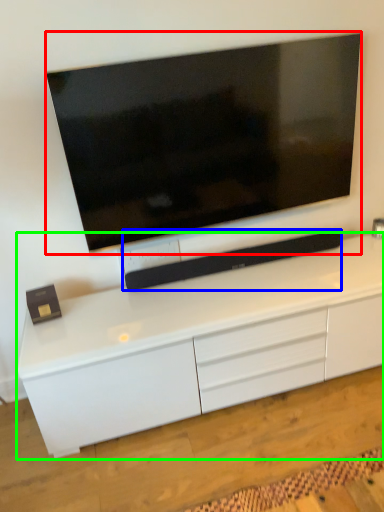
Question: Which is farther away from television (highlighted by a red box)? equipment (highlighted by a blue box) or cabinetry (highlighted by a green box)?

Choices:
 (A) equipment
 (B) cabinetry

Answer: (B)